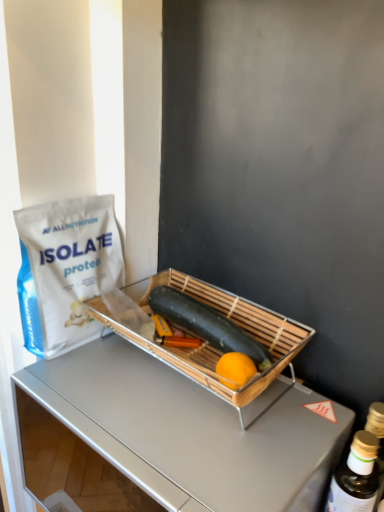
Question: From the image's perspective, is smooth green zucchini at center above or below gold metallic bottle at right?

Choices:
 (A) below
 (B) above

Answer: (B)

Question: Considering the positions of smooth green zucchini at center and gold metallic bottle at right in the image, is smooth green zucchini at center bigger or smaller than gold metallic bottle at right?

Choices:
 (A) big
 (B) small

Answer: (B)

Question: Which of these objects is positioned closest to the metallic silver desk at center?

Choices:
 (A) white matte protein powder bag at left
 (B) smooth green zucchini at center
 (C) gold metallic bottle at right
 (D) bamboo tray at center

Answer: (D)

Question: Which of these objects is positioned closest to the smooth green zucchini at center?

Choices:
 (A) white matte protein powder bag at left
 (B) gold metallic bottle at right
 (C) bamboo tray at center
 (D) metallic silver desk at center

Answer: (C)